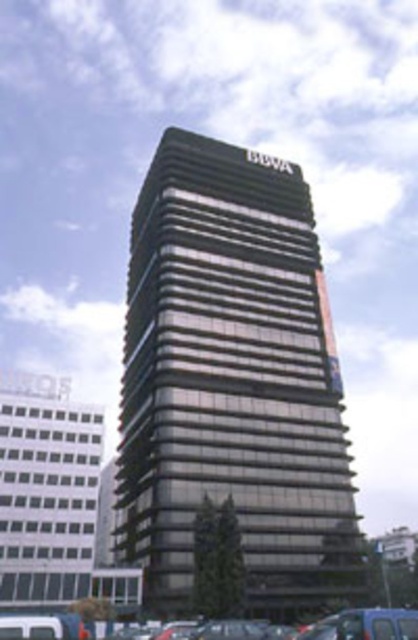
Is metallic glass tower at center wider than metallic gray cars at lower center?

No, metallic glass tower at center is not wider than metallic gray cars at lower center.

Who is more distant from viewer, (303, 246) or (359, 636)?

The point (303, 246) is behind.

Who is more distant from viewer, (x=180, y=396) or (x=171, y=630)?

Positioned behind is point (x=180, y=396).

Find the location of a particular element. This screenshot has width=418, height=640. metallic glass tower at center is located at coordinates (232, 384).